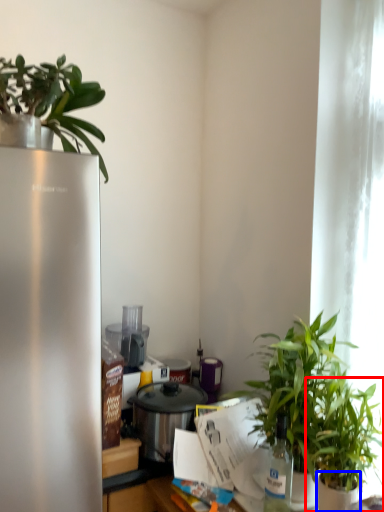
Question: Which object appears farthest to the camera in this image, houseplant (highlighted by a red box) or flowerpot (highlighted by a blue box)?

Choices:
 (A) houseplant
 (B) flowerpot

Answer: (A)